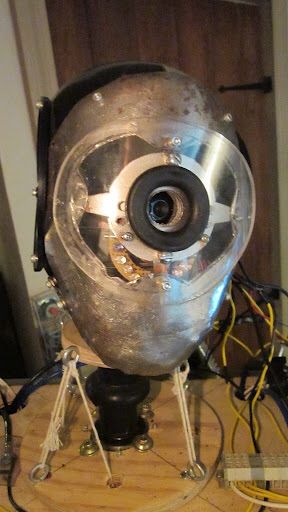
The image size is (288, 512). What are the coordinates of `two hooks on base` in the screenshot? It's located at (206, 477), (42, 469), (159, 481).